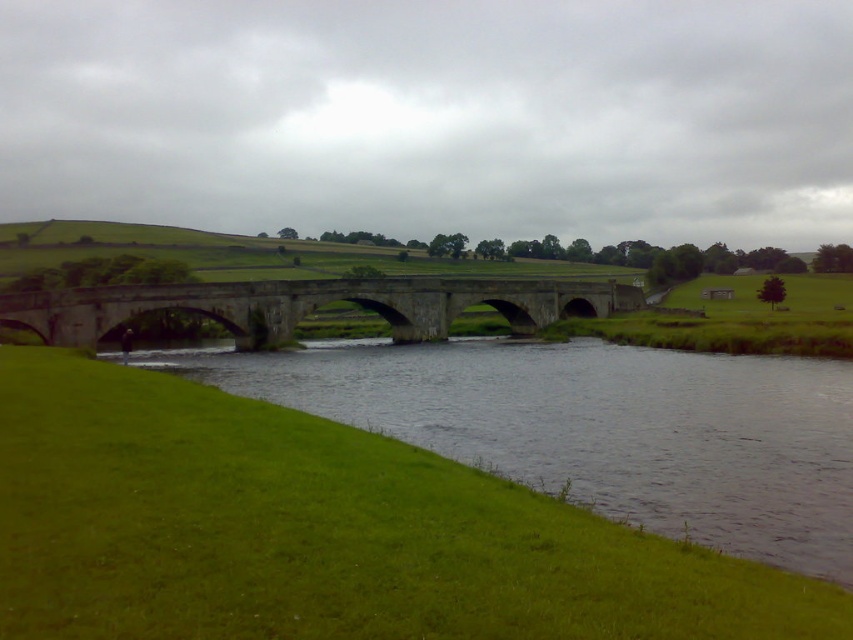
You are standing at the point marked as point (596, 428) in the image. What do you see in front of you?

The point (596, 428) indicates green grassy river at lower left, so you are standing at the green grassy river at lower left and looking towards the bridge spanning across the river.

You are a landscape architect evaluating the image. You need to determine if the green grassy river at lower left can accommodate a new small footpath along its edge without encroaching on the stone bridge at center. Based on the scene description, can the footpath be placed there?

The green grassy river at lower left has a width less than the stone bridge at center. Since the river is narrower than the bridge, there might not be enough space along its edge to place the footpath without getting too close to the bridge. Therefore, the footpath may not fit comfortably along the riverbank next to the stone bridge at center.

You are a landscape architect analyzing the image. You need to determine which area has a larger footprint in the scene between the green grassy river at lower left and the stone bridge at center. Which one is it?

The stone bridge at center has a larger footprint than the green grassy river at lower left according to the description.